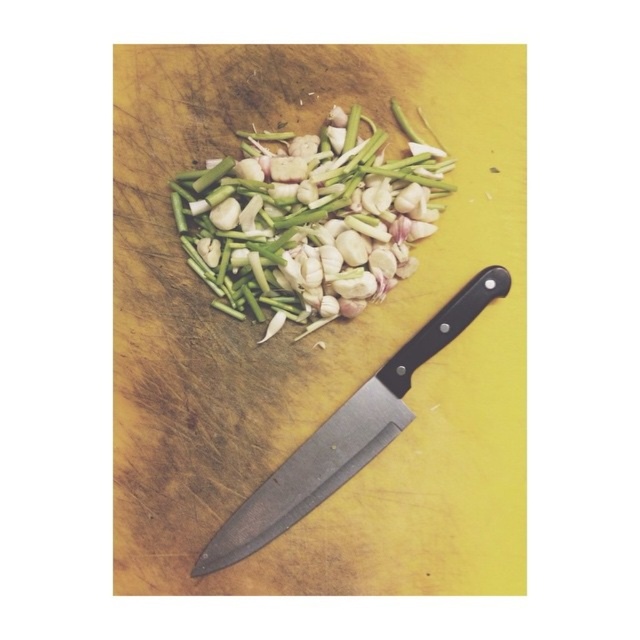
Consider the image. You are preparing a dish and need to place the black matte knife at lower right back into its holder. The holder is located to the left of the wooden cutting board at center. Can you move the knife directly to the left without moving the cutting board?

The wooden cutting board at center is above the black matte knife at lower right, so the knife is positioned to the lower part of the cutting board. To move it to the left of the cutting board, you would need to move it sideways, but since the cutting board is above the knife, the knife is already below it. Therefore, moving it directly left might be possible if there is space, but the description does not specify the horizontal position relative to the cutting board. However, based on the given information

Please provide the 2D coordinates of the green matte garlic at center in the image. The answer must be in the format of coordinates in parentheses, like so, for example, if the coordinates were at point 0.3, 0.4, you would write the answer as follows. Answer the question based on the provided information. The coordinates are at point 0.345, 0.484. So the answer is simply the coordinates in parentheses. Please do not add any extra text or explanation. Just the coordinates in parentheses. The question is,

The 2D coordinates of the green matte garlic at center are at point (x=308, y=220). So the answer is simply the coordinates in parentheses. The coordinates are at point (x=308, y=220). So the answer is simply the coordinates in parentheses. Please do not add any extra text or explanation. Just the coordinates in parentheses. The question is,